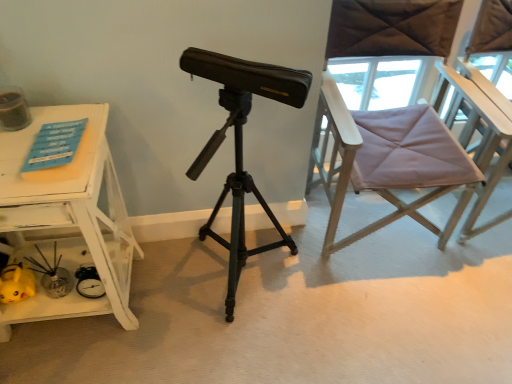
Question: From a real-world perspective, is white painted wood table at left above or below purple fabric chair at right?

Choices:
 (A) below
 (B) above

Answer: (A)

Question: Considering the positions of white painted wood table at left and purple fabric chair at right in the image, is white painted wood table at left taller or shorter than purple fabric chair at right?

Choices:
 (A) tall
 (B) short

Answer: (B)

Question: Which of these objects is positioned farthest from the matte black tripod at center?

Choices:
 (A) white painted wood table at left
 (B) purple fabric chair at right

Answer: (B)

Question: Considering the real-world distances, which object is farthest from the white painted wood table at left?

Choices:
 (A) matte black tripod at center
 (B) purple fabric chair at right

Answer: (B)